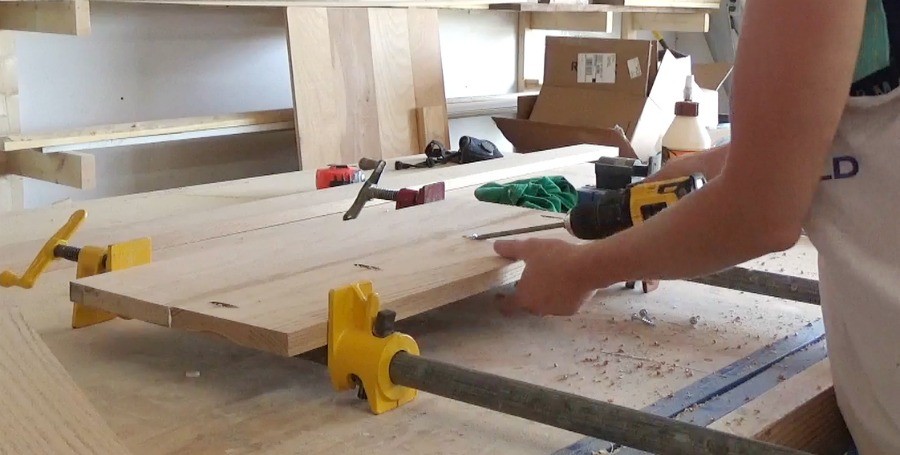
Locate an element on the screen. The width and height of the screenshot is (900, 455). box is located at coordinates (597, 111).